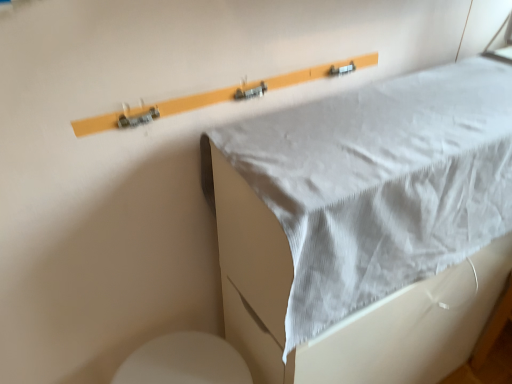
What do you see at coordinates (366, 226) in the screenshot?
I see `white fabric at upper center` at bounding box center [366, 226].

Locate an element on the screen. The width and height of the screenshot is (512, 384). white fabric at upper center is located at coordinates (366, 226).

Image resolution: width=512 pixels, height=384 pixels. Describe the element at coordinates (184, 361) in the screenshot. I see `white glossy toilet at lower left` at that location.

Identify the location of white glossy toilet at lower left. (184, 361).

Where is `white fabric at upper center`? white fabric at upper center is located at coordinates (366, 226).

Visually, is white fabric at upper center positioned to the left or to the right of white glossy toilet at lower left?

Based on their positions, white fabric at upper center is located to the right of white glossy toilet at lower left.

Is white fabric at upper center positioned behind white glossy toilet at lower left?

No, white fabric at upper center is closer to the viewer.

Is point (409, 166) positioned after point (167, 350)?

No, it is in front of (167, 350).

From the image's perspective, is white fabric at upper center above white glossy toilet at lower left?

Indeed, from the image's perspective, white fabric at upper center is shown above white glossy toilet at lower left.

From a real-world perspective, is white fabric at upper center physically located above or below white glossy toilet at lower left?

white fabric at upper center is situated higher than white glossy toilet at lower left in the real world.

Which object is thinner, white fabric at upper center or white glossy toilet at lower left?

white glossy toilet at lower left is thinner.

Looking at this image, considering the sizes of white fabric at upper center and white glossy toilet at lower left in the image, is white fabric at upper center taller or shorter than white glossy toilet at lower left?

Considering their sizes, white fabric at upper center has more height than white glossy toilet at lower left.

Which of these two, white fabric at upper center or white glossy toilet at lower left, is bigger?

Bigger between the two is white fabric at upper center.

Would you say white fabric at upper center is inside or outside white glossy toilet at lower left?

The correct answer is: outside.

Would you say white fabric at upper center is a long distance from white glossy toilet at lower left?

That's not correct — white fabric at upper center is a little close to white glossy toilet at lower left.

Is white fabric at upper center oriented towards white glossy toilet at lower left?

No, white fabric at upper center is not aimed at white glossy toilet at lower left.

How much distance is there between white fabric at upper center and white glossy toilet at lower left?

The distance of white fabric at upper center from white glossy toilet at lower left is 16.01 inches.

The height and width of the screenshot is (384, 512). In the image, there is a white fabric at upper center. Find the location of `toilet below it (from a real-world perspective)`. toilet below it (from a real-world perspective) is located at coordinates pos(184,361).

Looking at this image, would you say white glossy toilet at lower left is to the left or to the right of white fabric at upper center in the picture?

Based on their positions, white glossy toilet at lower left is located to the left of white fabric at upper center.

Which object is closer to the camera, white glossy toilet at lower left or white fabric at upper center?

Positioned in front is white fabric at upper center.

Is point (168, 352) farther from camera compared to point (336, 196)?

That is True.

From the image's perspective, does white glossy toilet at lower left appear lower than white fabric at upper center?

Yes, from the image's perspective, white glossy toilet at lower left is beneath white fabric at upper center.

From the picture: From a real-world perspective, which is physically below, white glossy toilet at lower left or white fabric at upper center?

white glossy toilet at lower left, from a real-world perspective.

Which object is wider, white glossy toilet at lower left or white fabric at upper center?

white fabric at upper center is wider.

Is white glossy toilet at lower left shorter than white fabric at upper center?

Yes, white glossy toilet at lower left is shorter than white fabric at upper center.

Who is bigger, white glossy toilet at lower left or white fabric at upper center?

Bigger between the two is white fabric at upper center.

Is white glossy toilet at lower left positioned beyond the bounds of white fabric at upper center?

Yes, white glossy toilet at lower left is outside of white fabric at upper center.

Based on the photo, are white glossy toilet at lower left and white fabric at upper center making contact?

white glossy toilet at lower left is not next to white fabric at upper center, and they're not touching.

Is white glossy toilet at lower left turned away from white fabric at upper center?

No.

Can you tell me how much white glossy toilet at lower left and white fabric at upper center differ in facing direction?

1.36 degrees separate the facing orientations of white glossy toilet at lower left and white fabric at upper center.

Where is `furniture on the right of white glossy toilet at lower left`? Image resolution: width=512 pixels, height=384 pixels. furniture on the right of white glossy toilet at lower left is located at coordinates (366, 226).

You are a GUI agent. You are given a task and a screenshot of the screen. Output one action in this format:
    pyautogui.click(x=<x>, y=<y>)
    Task: Click on the toilet that appears below the white fabric at upper center (from the image's perspective)
    The height and width of the screenshot is (384, 512).
    Given the screenshot: What is the action you would take?
    pyautogui.click(x=184, y=361)

Image resolution: width=512 pixels, height=384 pixels. Find the location of `furniture above the white glossy toilet at lower left (from a real-world perspective)`. furniture above the white glossy toilet at lower left (from a real-world perspective) is located at coordinates (366, 226).